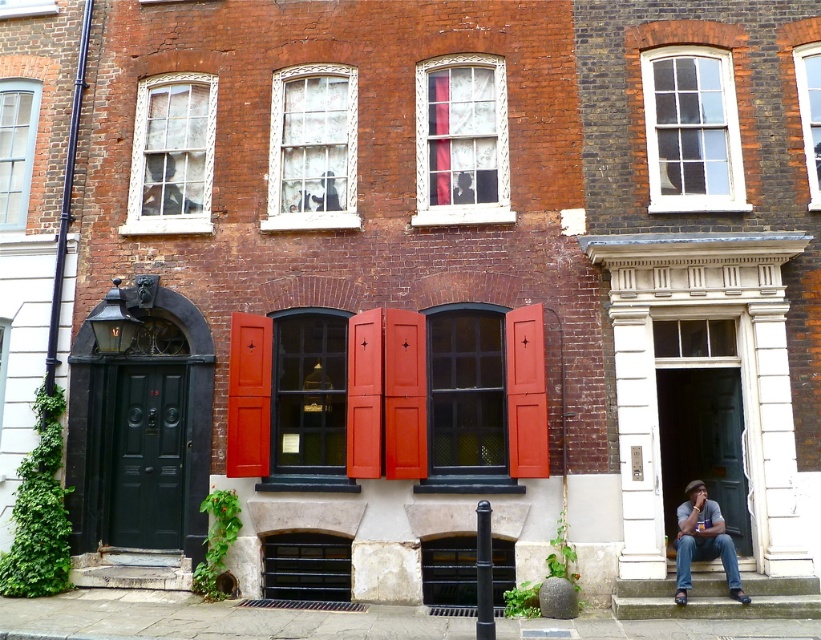
Can you confirm if white textured glass window at center is positioned below white textured window at upper left?

Actually, white textured glass window at center is above white textured window at upper left.

Between point (482, 182) and point (158, 93), which one is positioned in front?

Point (482, 182) is more forward.

Identify the location of white textured glass window at center. (461, 141).

Can you confirm if matte black window at center is positioned below white textured window at upper left?

Indeed, matte black window at center is positioned under white textured window at upper left.

Based on the photo, between matte black window at center and white textured window at upper left, which one is positioned higher?

Positioned higher is white textured window at upper left.

Consider the image. Who is more forward, (491, 381) or (190, 168)?

Positioned in front is point (491, 381).

Identify the location of matte black window at center. (466, 396).

Who is more distant from viewer, (659, 161) or (723, 528)?

The point (659, 161) is behind.

Find the location of `white glass window at upper right`. white glass window at upper right is located at coordinates (691, 131).

Who is more distant from viewer, (741, 170) or (704, 508)?

Point (741, 170)

Identify the location of white glass window at upper right. (691, 131).